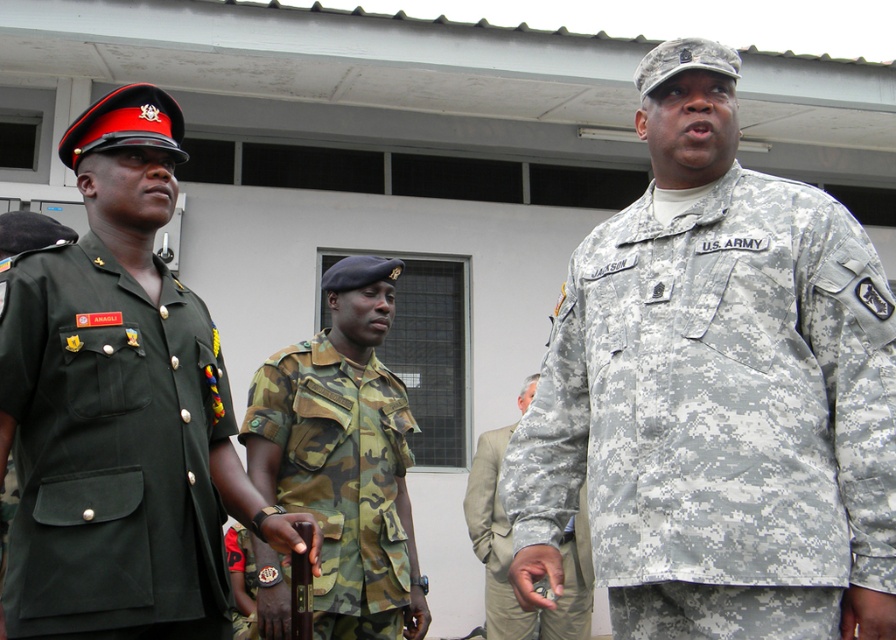
Question: Does green fabric uniform at left have a smaller size compared to camouflage fabric uniform at center?

Choices:
 (A) yes
 (B) no

Answer: (A)

Question: Does camouflage fabric us army uniform at center have a larger size compared to green fabric uniform at left?

Choices:
 (A) yes
 (B) no

Answer: (A)

Question: Which object is farther from the camera taking this photo?

Choices:
 (A) green fabric uniform at left
 (B) camouflage fabric uniform at center
 (C) camo fabric uniform at center
 (D) camouflage fabric us army uniform at center

Answer: (B)

Question: Which object is closer to the camera taking this photo?

Choices:
 (A) camo fabric uniform at center
 (B) camouflage fabric uniform at center
 (C) green fabric uniform at left
 (D) camouflage fabric us army uniform at center

Answer: (D)

Question: Which of the following is the closest to the observer?

Choices:
 (A) green fabric uniform at left
 (B) camouflage fabric uniform at center
 (C) camo fabric uniform at center
 (D) camouflage fabric us army uniform at center

Answer: (D)

Question: Does green fabric uniform at left come in front of camo fabric uniform at center?

Choices:
 (A) yes
 (B) no

Answer: (A)